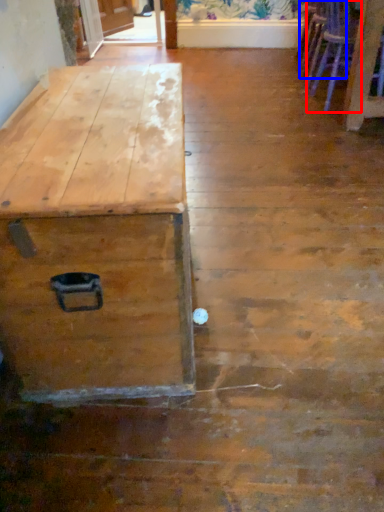
Question: Among these objects, which one is nearest to the camera, armchair (highlighted by a red box) or armchair (highlighted by a blue box)?

Choices:
 (A) armchair
 (B) armchair

Answer: (A)